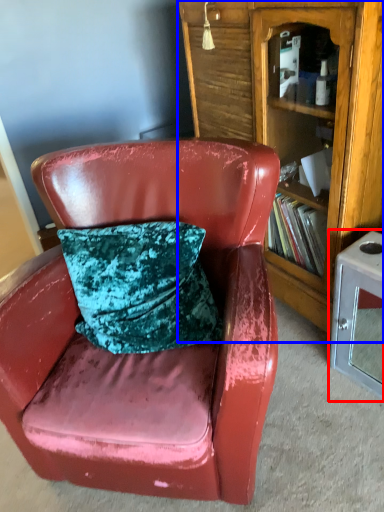
Question: Which of the following is the farthest to the observer, table (highlighted by a red box) or bookcase (highlighted by a blue box)?

Choices:
 (A) table
 (B) bookcase

Answer: (A)